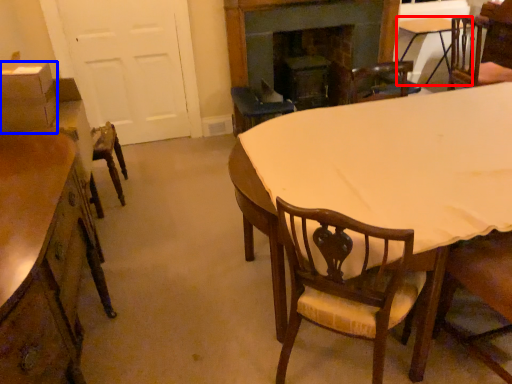
Question: Which of the following is the closest to the observer, table (highlighted by a red box) or box (highlighted by a blue box)?

Choices:
 (A) table
 (B) box

Answer: (B)